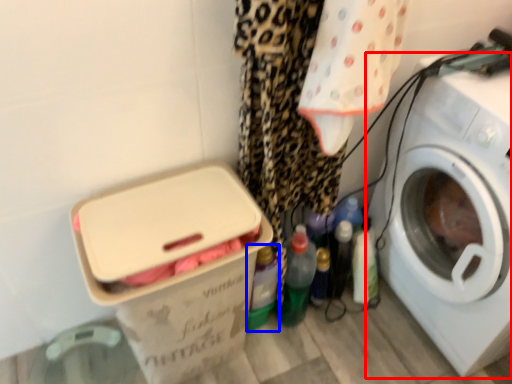
Question: Which of the following is the farthest to the observer, washing machine (highlighted by a red box) or bottle (highlighted by a blue box)?

Choices:
 (A) washing machine
 (B) bottle

Answer: (B)